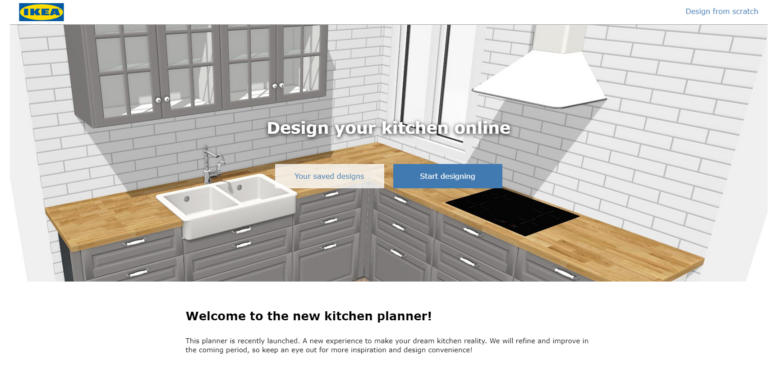
Where is `sink basins`? Image resolution: width=768 pixels, height=382 pixels. sink basins is located at coordinates (200, 209), (250, 197).